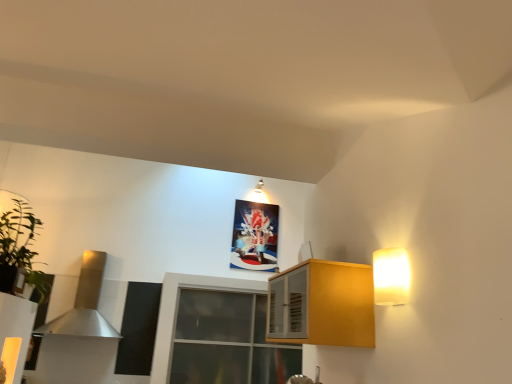
Question: Should I look upward or downward to see white glossy light fixture at upper center, which ranks as the first light fixture in top-to-bottom order?

Choices:
 (A) up
 (B) down

Answer: (A)

Question: Does yellow matte cabinet at right contain white glossy light fixture at upper center, the first light fixture when ordered from left to right?

Choices:
 (A) no
 (B) yes

Answer: (A)

Question: Is yellow matte cabinet at right at the left side of white glossy light fixture at upper center, the first light fixture when ordered from left to right?

Choices:
 (A) no
 (B) yes

Answer: (A)

Question: From a real-world perspective, is yellow matte cabinet at right over white glossy light fixture at upper center, which appears as the second light fixture when viewed from the front?

Choices:
 (A) yes
 (B) no

Answer: (B)

Question: Is the position of yellow matte cabinet at right less distant than that of white glossy light fixture at upper center, which ranks as the first light fixture in top-to-bottom order?

Choices:
 (A) no
 (B) yes

Answer: (B)

Question: Is yellow matte cabinet at right far away from white glossy light fixture at upper center, which ranks as the first light fixture in top-to-bottom order?

Choices:
 (A) no
 (B) yes

Answer: (B)

Question: From a real-world perspective, is yellow matte cabinet at right located beneath white glossy light fixture at upper center, arranged as the 2th light fixture when ordered from the bottom?

Choices:
 (A) yes
 (B) no

Answer: (A)

Question: From the image's perspective, is white glossy light fixture at upper center, which appears as the 1th light fixture when viewed from the back, on top of satin gold exhaust hood at left?

Choices:
 (A) yes
 (B) no

Answer: (A)

Question: Can you confirm if white glossy light fixture at upper center, the first light fixture when ordered from left to right, is positioned to the right of satin gold exhaust hood at left?

Choices:
 (A) no
 (B) yes

Answer: (B)

Question: From the image's perspective, is white glossy light fixture at upper center, which appears as the 1th light fixture when viewed from the back, located beneath satin gold exhaust hood at left?

Choices:
 (A) yes
 (B) no

Answer: (B)

Question: Would you say white glossy light fixture at upper center, which ranks as the first light fixture in top-to-bottom order, is outside satin gold exhaust hood at left?

Choices:
 (A) no
 (B) yes

Answer: (B)

Question: From a real-world perspective, is white glossy light fixture at upper center, which appears as the 1th light fixture when viewed from the back, positioned under satin gold exhaust hood at left based on gravity?

Choices:
 (A) no
 (B) yes

Answer: (A)

Question: Is white glossy light fixture at upper center, which ranks as the second light fixture in right-to-left order, touching satin gold exhaust hood at left?

Choices:
 (A) no
 (B) yes

Answer: (A)

Question: Is white glossy light fixture at upper center, the first light fixture when ordered from left to right, oriented towards transparent glass window at center?

Choices:
 (A) no
 (B) yes

Answer: (A)